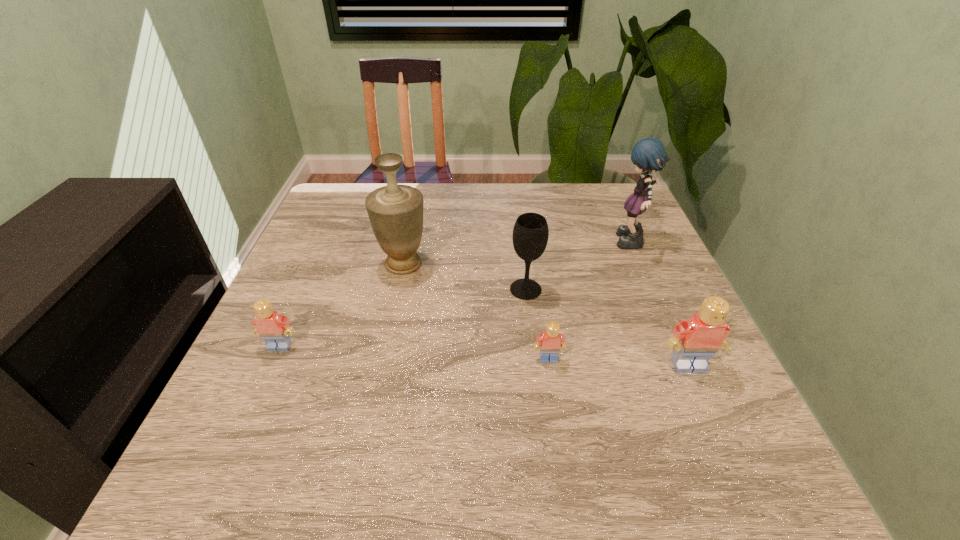
This screenshot has width=960, height=540. I want to click on spot to insert another Lego for uniform distribution, so click(412, 353).